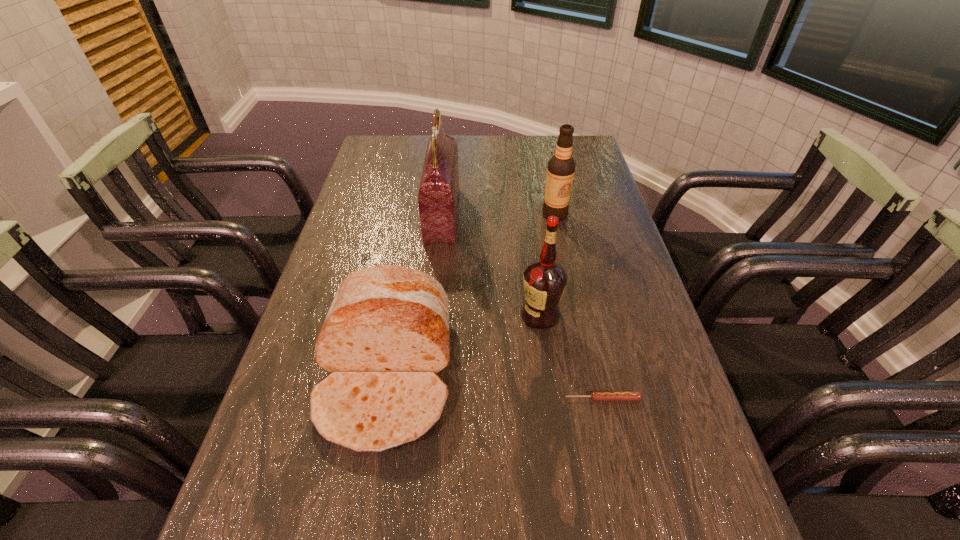
Locate an element on the screen. Image resolution: width=960 pixels, height=540 pixels. vacant area that lies between the farther alcohol and the handbag is located at coordinates (499, 215).

Where is `free spot between the nearer alcohol and the shortest object`? free spot between the nearer alcohol and the shortest object is located at coordinates (571, 357).

Find the location of a particular element. This screenshot has height=540, width=960. free point between the farther alcohol and the handbag is located at coordinates [499, 215].

Where is `vacant space that's between the nearer alcohol and the shortest object`? The image size is (960, 540). vacant space that's between the nearer alcohol and the shortest object is located at coordinates (571, 357).

You are a GUI agent. You are given a task and a screenshot of the screen. Output one action in this format:
    pyautogui.click(x=<x>, y=<y>)
    Task: Click on the blank region between the handbag and the nearer alcohol
    
    Given the screenshot: What is the action you would take?
    pyautogui.click(x=492, y=265)

Where is `the third closest object to the handbag`? Image resolution: width=960 pixels, height=540 pixels. the third closest object to the handbag is located at coordinates (545, 280).

Point out which object is positioned as the fourth nearest to the nearer alcohol. Please provide its 2D coordinates. Your answer should be formatted as a tuple, i.e. [(x, y)], where the tuple contains the x and y coordinates of a point satisfying the conditions above.

[(561, 167)]

Locate an element on the screen. The width and height of the screenshot is (960, 540). free space that satisfies the following two spatial constraints: 1. on the label of the sausage; 2. on the left side of the nearer alcohol is located at coordinates (551, 399).

The height and width of the screenshot is (540, 960). I want to click on free spot that satisfies the following two spatial constraints: 1. on the label of the sausage; 2. on the right side of the farther alcohol, so click(593, 399).

Where is `free region that satisfies the following two spatial constraints: 1. on the label of the nearer alcohol; 2. at the sliced end of the bread`? free region that satisfies the following two spatial constraints: 1. on the label of the nearer alcohol; 2. at the sliced end of the bread is located at coordinates (547, 372).